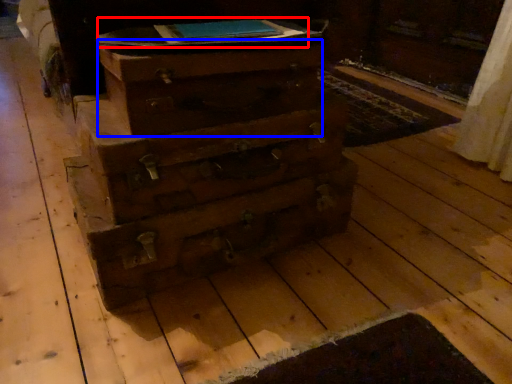
Question: Which of the following is the farthest to the observer, book (highlighted by a red box) or drawer (highlighted by a blue box)?

Choices:
 (A) book
 (B) drawer

Answer: (A)